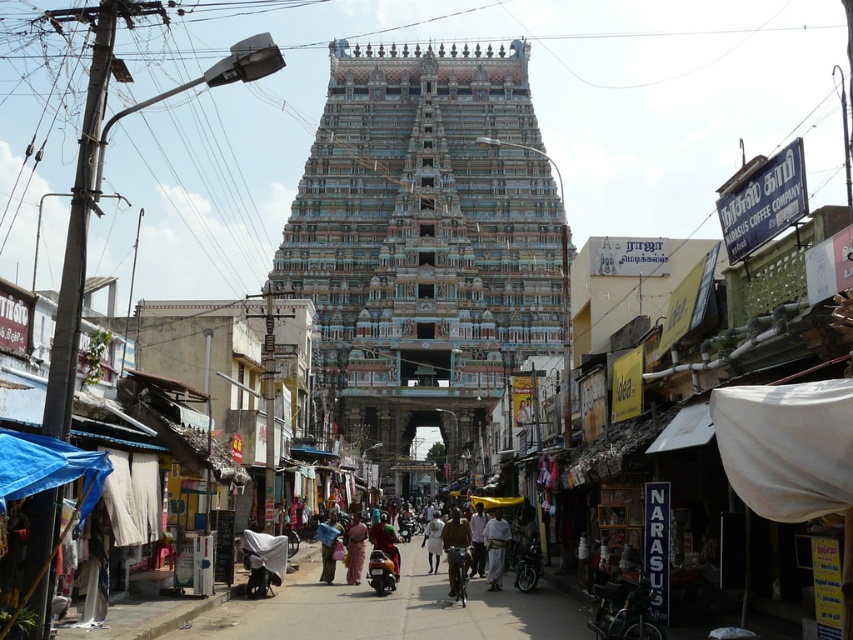
Question: Among these points, which one is farthest from the camera?

Choices:
 (A) (387, 532)
 (B) (450, 577)

Answer: (A)

Question: Is brown leather jacket at center to the right of white cotton cloth at center from the viewer's perspective?

Choices:
 (A) no
 (B) yes

Answer: (B)

Question: Which object is the farthest from the brown leather jacket at center?

Choices:
 (A) blue tarpaulin canopy at lower left
 (B) white cotton dress at center
 (C) white cotton cloth at center
 (D) multicolored mosaic temple at center

Answer: (D)

Question: Is blue tarpaulin canopy at lower left smaller than multicolored fabric at center?

Choices:
 (A) yes
 (B) no

Answer: (B)

Question: Is blue tarpaulin canopy at lower left below white cotton dhoti at center?

Choices:
 (A) yes
 (B) no

Answer: (B)

Question: Among these objects, which one is nearest to the camera?

Choices:
 (A) multicolored mosaic temple at center
 (B) blue fabric at center
 (C) dark skin human at center
 (D) white cotton cloth at center

Answer: (B)